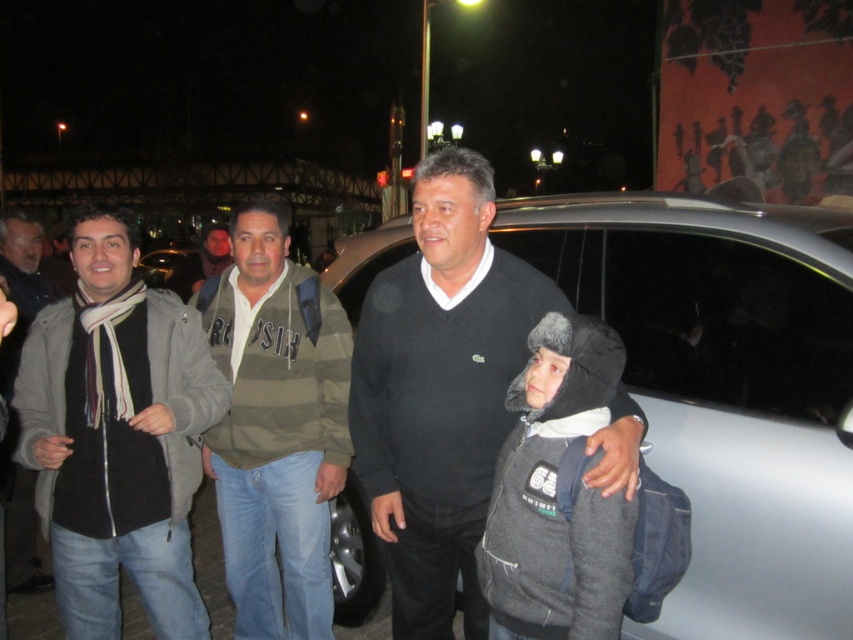
Is dark gray fleece jacket at center shorter than black wool scarf at left?

Yes, dark gray fleece jacket at center is shorter than black wool scarf at left.

Which is below, dark gray fleece jacket at center or black wool scarf at left?

dark gray fleece jacket at center is below.

What do you see at coordinates (555, 496) in the screenshot? This screenshot has height=640, width=853. I see `dark gray fleece jacket at center` at bounding box center [555, 496].

Where is `dark gray fleece jacket at center`? dark gray fleece jacket at center is located at coordinates (555, 496).

Is dark gray fleece jacket at center below dark gray hoodie at center?

Correct, dark gray fleece jacket at center is located below dark gray hoodie at center.

Between point (538, 353) and point (222, 244), which one is positioned in front?

Point (538, 353) is in front.

This screenshot has width=853, height=640. Find the location of `dark gray fleece jacket at center`. dark gray fleece jacket at center is located at coordinates (555, 496).

Looking at this image, can you confirm if silver metallic car at center is positioned below dark gray hoodie at center?

Correct, silver metallic car at center is located below dark gray hoodie at center.

Consider the image. Who is more forward, [693,563] or [213,227]?

Point [693,563]

I want to click on silver metallic car at center, so click(x=724, y=387).